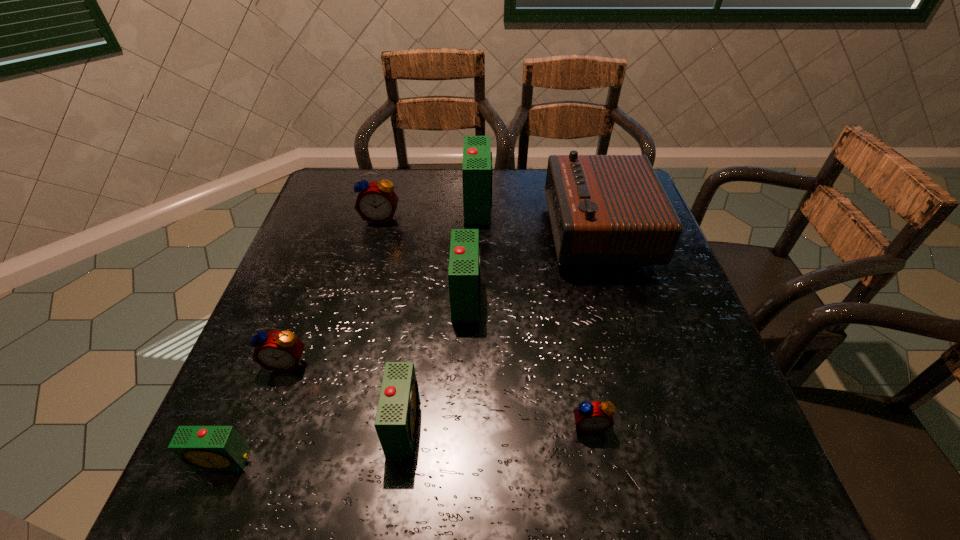
At what (x,y) coordinates should I click in order to perform the action: click on the farthest green alarm clock. Please return your answer as a coordinate pair (x, y). The width and height of the screenshot is (960, 540). Looking at the image, I should click on (477, 157).

Identify the location of the biggest green alarm clock. Image resolution: width=960 pixels, height=540 pixels. (477, 157).

Find the location of a particular element. radio receiver is located at coordinates (605, 210).

Where is `the sixth object from right to left`? The height and width of the screenshot is (540, 960). the sixth object from right to left is located at coordinates (376, 202).

You are a GUI agent. You are given a task and a screenshot of the screen. Output one action in this format:
    pyautogui.click(x=<x>, y=<y>)
    Task: Click on the biggest red alarm clock
    The width and height of the screenshot is (960, 540).
    Given the screenshot: What is the action you would take?
    pyautogui.click(x=376, y=202)

The height and width of the screenshot is (540, 960). I want to click on the third smallest green alarm clock, so [x=464, y=260].

The image size is (960, 540). What are the coordinates of `the third nearest green alarm clock` in the screenshot? It's located at (464, 260).

Where is `the second nearest red alarm clock`? This screenshot has height=540, width=960. the second nearest red alarm clock is located at coordinates (281, 351).

I want to click on the fourth farthest alarm clock, so click(x=281, y=351).

Where is `the second green alarm clock from left to right`? the second green alarm clock from left to right is located at coordinates click(396, 421).